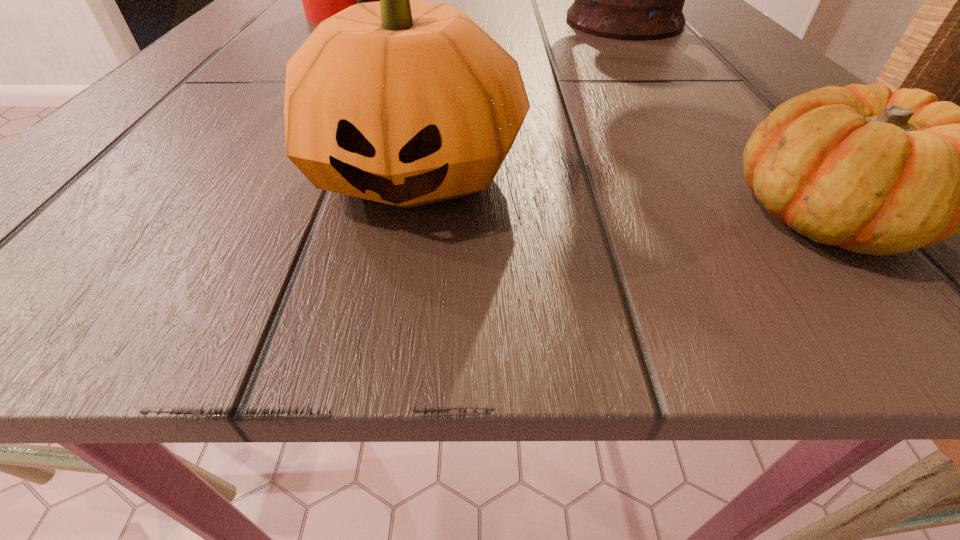
Find the location of a particular element. oil lamp is located at coordinates (636, 0).

At what (x,y) coordinates should I click in order to perform the action: click on the second shortest object. Please return your answer as a coordinate pair (x, y). The width and height of the screenshot is (960, 540). Looking at the image, I should click on (404, 102).

Identify the location of the taller gourd. This screenshot has height=540, width=960. (404, 102).

Locate an element on the screen. This screenshot has height=540, width=960. vacant space located on the left of the oil lamp is located at coordinates (425, 21).

In order to click on vacant region located 0.050m on the side of the third tallest object with the carved face in this screenshot , I will do `click(393, 292)`.

At what (x,y) coordinates should I click in order to perform the action: click on object at the far edge. Please return your answer as a coordinate pair (x, y). This screenshot has height=540, width=960. Looking at the image, I should click on (636, 0).

Identify the location of object that is at the near edge. The width and height of the screenshot is (960, 540). (404, 102).

Find the location of a particular element. The height and width of the screenshot is (540, 960). object present at the right edge is located at coordinates point(636,0).

Image resolution: width=960 pixels, height=540 pixels. In order to click on object at the far right corner in this screenshot , I will do `click(636, 0)`.

Find the location of a particular element. This screenshot has height=540, width=960. free space at the near edge of the desktop is located at coordinates (432, 259).